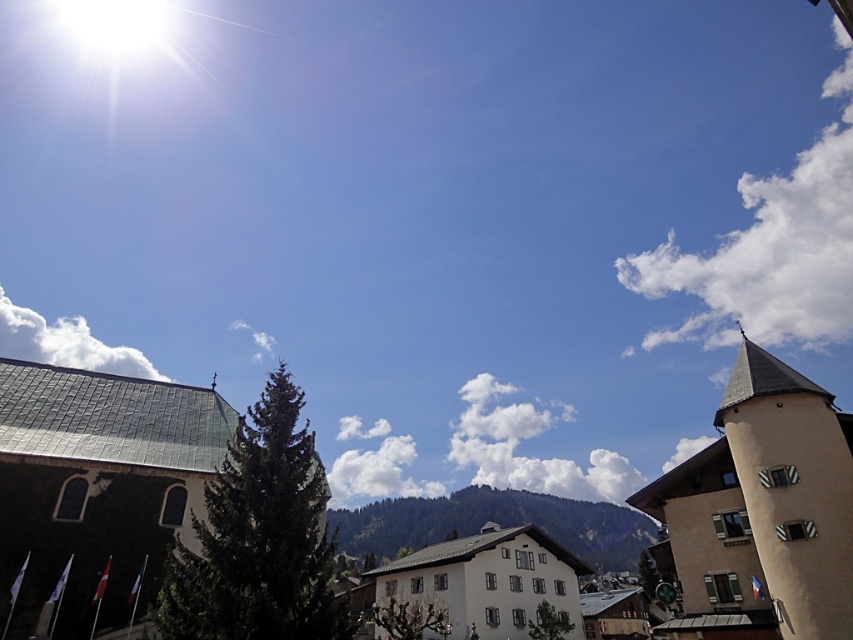
Does smooth stone building at center have a larger size compared to white fluffy cloud at upper left?

Actually, smooth stone building at center might be smaller than white fluffy cloud at upper left.

Is smooth stone building at center to the right of white fluffy cloud at upper left from the viewer's perspective?

Indeed, smooth stone building at center is positioned on the right side of white fluffy cloud at upper left.

Which is in front, point (827, 620) or point (0, 320)?

Positioned in front is point (827, 620).

The image size is (853, 640). What are the coordinates of `smooth stone building at center` in the screenshot? It's located at (97, 486).

I want to click on beige stone tower at right, so click(793, 490).

Who is more forward, [805,563] or [126,356]?

Point [805,563] is in front.

Does point (782, 602) come in front of point (77, 346)?

That is True.

Locate an element on the screen. The width and height of the screenshot is (853, 640). beige stone tower at right is located at coordinates (793, 490).

Can you confirm if beige stone tower at right is wider than white fluffy cloud at center?

No.

Is beige stone tower at right shorter than white fluffy cloud at center?

Yes, beige stone tower at right is shorter than white fluffy cloud at center.

Is point (792, 586) positioned after point (357, 422)?

No, (792, 586) is in front of (357, 422).

You are a GUI agent. You are given a task and a screenshot of the screen. Output one action in this format:
    pyautogui.click(x=<x>, y=<y>)
    Task: Click on the beige stone tower at right
    This screenshot has height=640, width=853.
    Given the screenshot: What is the action you would take?
    pyautogui.click(x=793, y=490)